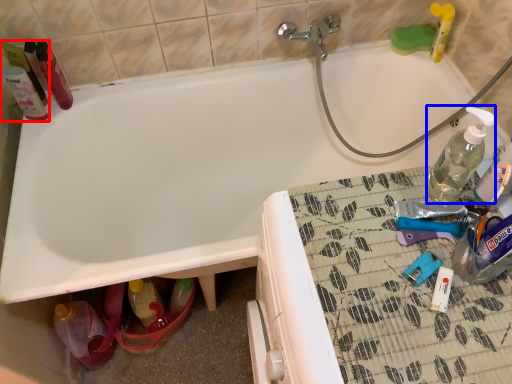
Question: Which object is closer to the camera taking this photo, cleaning product (highlighted by a red box) or bottle (highlighted by a blue box)?

Choices:
 (A) cleaning product
 (B) bottle

Answer: (B)